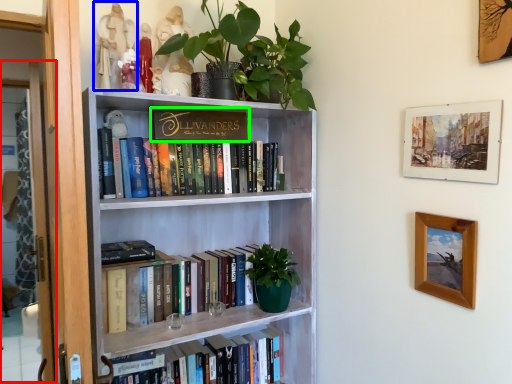
Question: Estimate the real-world distances between objects in this image. Which object is farther from glass door (highlighted by a red box), toy (highlighted by a blue box) or book (highlighted by a green box)?

Choices:
 (A) toy
 (B) book

Answer: (B)